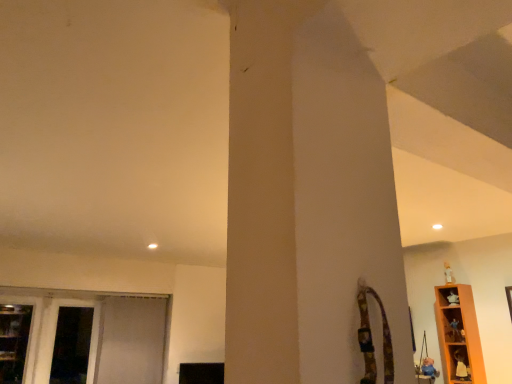
Consider the image. Measure the distance between white fabric screen door at lower left, the first screen door when ordered from right to left, and camera.

The distance of white fabric screen door at lower left, the first screen door when ordered from right to left, from camera is 3.99 meters.

Measure the distance between orange wood shelf at right, the 2th shelf from the bottom, and camera.

A distance of 3.07 meters exists between orange wood shelf at right, the 2th shelf from the bottom, and camera.

Image resolution: width=512 pixels, height=384 pixels. Find the location of `white fabric screen door at lower left, the first screen door when ordered from right to left`. white fabric screen door at lower left, the first screen door when ordered from right to left is located at coordinates (131, 341).

From a real-world perspective, is white fabric screen door at lower left, the first screen door when ordered from right to left, located beneath wooden shelf at lower right, which is the 2th shelf in top-to-bottom order?

No, from a real-world perspective, white fabric screen door at lower left, the first screen door when ordered from right to left, is not beneath wooden shelf at lower right, which is the 2th shelf in top-to-bottom order.

Does white fabric screen door at lower left, the first screen door when ordered from right to left, have a larger size compared to wooden shelf at lower right, which is the first shelf from bottom to top?

Yes.

Is white fabric screen door at lower left, the first screen door when ordered from right to left, situated inside wooden shelf at lower right, which is the first shelf from bottom to top, or outside?

white fabric screen door at lower left, the first screen door when ordered from right to left, is not enclosed by wooden shelf at lower right, which is the first shelf from bottom to top.

Identify the location of screen door on the left of the white fabric screen door at lower left, positioned as the second screen door in left-to-right order. This screenshot has width=512, height=384. (72, 345).

Which of these two, white fabric screen door at lower left, positioned as the second screen door in left-to-right order, or white fabric screen door at left, the second screen door in the right-to-left sequence, stands taller?

With more height is white fabric screen door at lower left, positioned as the second screen door in left-to-right order.

Is white fabric screen door at lower left, the first screen door when ordered from right to left, behind white fabric screen door at left, the second screen door in the right-to-left sequence?

Yes, it is.

Is white fabric screen door at lower left, the first screen door when ordered from right to left, with white fabric screen door at left, which is the 1th screen door in left-to-right order?

white fabric screen door at lower left, the first screen door when ordered from right to left, and white fabric screen door at left, which is the 1th screen door in left-to-right order, are clearly separated.

Is orange wood shelf at right, the 2th shelf from the bottom, inside or outside of white fabric screen door at left, the second screen door in the right-to-left sequence?

orange wood shelf at right, the 2th shelf from the bottom, is spatially situated outside white fabric screen door at left, the second screen door in the right-to-left sequence.

From the image's perspective, starting from the white fabric screen door at left, which is the 1th screen door in left-to-right order, which shelf is the 2nd one above? Please provide its 2D coordinates.

[(459, 335)]

Does orange wood shelf at right, the 1th shelf positioned from the top, turn towards white fabric screen door at left, which is the 1th screen door in left-to-right order?

No, orange wood shelf at right, the 1th shelf positioned from the top, is not aimed at white fabric screen door at left, which is the 1th screen door in left-to-right order.

Who is taller, orange wood shelf at right, the 2th shelf from the bottom, or white fabric screen door at left, the second screen door in the right-to-left sequence?

white fabric screen door at left, the second screen door in the right-to-left sequence, is taller.

Is orange wood shelf at right, the 1th shelf positioned from the top, positioned far away from wooden shelf at lower right, which is the 2th shelf in top-to-bottom order?

orange wood shelf at right, the 1th shelf positioned from the top, is actually quite close to wooden shelf at lower right, which is the 2th shelf in top-to-bottom order.

Is the position of orange wood shelf at right, the 1th shelf positioned from the top, more distant than that of wooden shelf at lower right, which is the first shelf from bottom to top?

No, it is in front of wooden shelf at lower right, which is the first shelf from bottom to top.

In terms of size, does orange wood shelf at right, the 2th shelf from the bottom, appear bigger or smaller than wooden shelf at lower right, which is the first shelf from bottom to top?

In the image, orange wood shelf at right, the 2th shelf from the bottom, appears to be larger than wooden shelf at lower right, which is the first shelf from bottom to top.

From a real-world perspective, is wooden shelf at lower right, which is the first shelf from bottom to top, beneath white fabric screen door at left, the second screen door in the right-to-left sequence?

Yes.

Can you confirm if wooden shelf at lower right, which is the 2th shelf in top-to-bottom order, is positioned to the right of white fabric screen door at left, which is the 1th screen door in left-to-right order?

Yes, wooden shelf at lower right, which is the 2th shelf in top-to-bottom order, is to the right of white fabric screen door at left, which is the 1th screen door in left-to-right order.

Who is bigger, wooden shelf at lower right, which is the 2th shelf in top-to-bottom order, or white fabric screen door at left, which is the 1th screen door in left-to-right order?

With larger size is white fabric screen door at left, which is the 1th screen door in left-to-right order.

Considering the positions of objects wooden shelf at lower right, which is the first shelf from bottom to top, and white fabric screen door at lower left, the first screen door when ordered from right to left, in the image provided, who is more to the right, wooden shelf at lower right, which is the first shelf from bottom to top, or white fabric screen door at lower left, the first screen door when ordered from right to left,?

wooden shelf at lower right, which is the first shelf from bottom to top.

Is wooden shelf at lower right, which is the first shelf from bottom to top, aimed at white fabric screen door at lower left, positioned as the second screen door in left-to-right order?

No, wooden shelf at lower right, which is the first shelf from bottom to top, does not turn towards white fabric screen door at lower left, positioned as the second screen door in left-to-right order.

Which of these two, wooden shelf at lower right, which is the first shelf from bottom to top, or white fabric screen door at lower left, the first screen door when ordered from right to left, is thinner?

wooden shelf at lower right, which is the first shelf from bottom to top.

From the image's perspective, who appears lower, wooden shelf at lower right, which is the 2th shelf in top-to-bottom order, or white fabric screen door at lower left, the first screen door when ordered from right to left?

white fabric screen door at lower left, the first screen door when ordered from right to left, appears lower in the image.

From a real-world perspective, between wooden shelf at lower right, which is the 2th shelf in top-to-bottom order, and orange wood shelf at right, the 2th shelf from the bottom, who is vertically lower?

wooden shelf at lower right, which is the 2th shelf in top-to-bottom order.

Does point (451, 358) lie in front of point (483, 371)?

No.

Does wooden shelf at lower right, which is the 2th shelf in top-to-bottom order, lie in front of orange wood shelf at right, the 2th shelf from the bottom?

No, it is not.

Choose the correct answer: Is wooden shelf at lower right, which is the first shelf from bottom to top, inside orange wood shelf at right, the 2th shelf from the bottom, or outside it?

wooden shelf at lower right, which is the first shelf from bottom to top, can be found inside orange wood shelf at right, the 2th shelf from the bottom.

From the image's perspective, which screen door is the 2nd one below the wooden shelf at lower right, which is the 2th shelf in top-to-bottom order? Please provide its 2D coordinates.

[(131, 341)]

You are a GUI agent. You are given a task and a screenshot of the screen. Output one action in this format:
    pyautogui.click(x=<x>, y=<y>)
    Task: Click on the screen door located underneath the white fabric screen door at lower left, the first screen door when ordered from right to left (from a real-world perspective)
    The height and width of the screenshot is (384, 512).
    Given the screenshot: What is the action you would take?
    pyautogui.click(x=72, y=345)

From the picture: Which object lies nearer to the anchor point white fabric screen door at left, the second screen door in the right-to-left sequence, wooden shelf at lower right, which is the first shelf from bottom to top, or orange wood shelf at right, the 1th shelf positioned from the top?

orange wood shelf at right, the 1th shelf positioned from the top.

From the image, which object appears to be farther from white fabric screen door at lower left, the first screen door when ordered from right to left, wooden shelf at lower right, which is the first shelf from bottom to top, or white fabric screen door at left, which is the 1th screen door in left-to-right order?

wooden shelf at lower right, which is the first shelf from bottom to top, is positioned further to the anchor white fabric screen door at lower left, the first screen door when ordered from right to left.

Which object lies further to the anchor point orange wood shelf at right, the 1th shelf positioned from the top, white fabric screen door at lower left, positioned as the second screen door in left-to-right order, or wooden shelf at lower right, which is the first shelf from bottom to top?

Among the two, white fabric screen door at lower left, positioned as the second screen door in left-to-right order, is located further to orange wood shelf at right, the 1th shelf positioned from the top.

Based on their spatial positions, is wooden shelf at lower right, which is the 2th shelf in top-to-bottom order, or white fabric screen door at left, the second screen door in the right-to-left sequence, further from orange wood shelf at right, the 2th shelf from the bottom?

The object further to orange wood shelf at right, the 2th shelf from the bottom, is white fabric screen door at left, the second screen door in the right-to-left sequence.

Based on their spatial positions, is white fabric screen door at lower left, the first screen door when ordered from right to left, or orange wood shelf at right, the 1th shelf positioned from the top, further from white fabric screen door at left, which is the 1th screen door in left-to-right order?

orange wood shelf at right, the 1th shelf positioned from the top.

From the picture: Based on their spatial positions, is orange wood shelf at right, the 1th shelf positioned from the top, or white fabric screen door at lower left, the first screen door when ordered from right to left, closer to white fabric screen door at left, which is the 1th screen door in left-to-right order?

white fabric screen door at lower left, the first screen door when ordered from right to left, lies closer to white fabric screen door at left, which is the 1th screen door in left-to-right order, than the other object.

When comparing their distances from white fabric screen door at left, the second screen door in the right-to-left sequence, does white fabric screen door at lower left, the first screen door when ordered from right to left, or wooden shelf at lower right, which is the first shelf from bottom to top, seem further?

wooden shelf at lower right, which is the first shelf from bottom to top, is further to white fabric screen door at left, the second screen door in the right-to-left sequence.

From the image, which object appears to be farther from wooden shelf at lower right, which is the first shelf from bottom to top, orange wood shelf at right, the 1th shelf positioned from the top, or white fabric screen door at left, the second screen door in the right-to-left sequence?

white fabric screen door at left, the second screen door in the right-to-left sequence, is positioned further to the anchor wooden shelf at lower right, which is the first shelf from bottom to top.

What are the coordinates of `screen door between white fabric screen door at left, the second screen door in the right-to-left sequence, and wooden shelf at lower right, which is the first shelf from bottom to top, from left to right` in the screenshot? It's located at click(x=131, y=341).

Locate an element on the screen. shelf situated between white fabric screen door at left, the second screen door in the right-to-left sequence, and orange wood shelf at right, the 2th shelf from the bottom, from left to right is located at coordinates (459, 363).

Identify the location of shelf located between white fabric screen door at lower left, the first screen door when ordered from right to left, and orange wood shelf at right, the 1th shelf positioned from the top, in the left-right direction. This screenshot has width=512, height=384. (459, 363).

The height and width of the screenshot is (384, 512). What are the coordinates of `screen door between white fabric screen door at left, the second screen door in the right-to-left sequence, and orange wood shelf at right, the 2th shelf from the bottom, in the horizontal direction` in the screenshot? It's located at (131, 341).